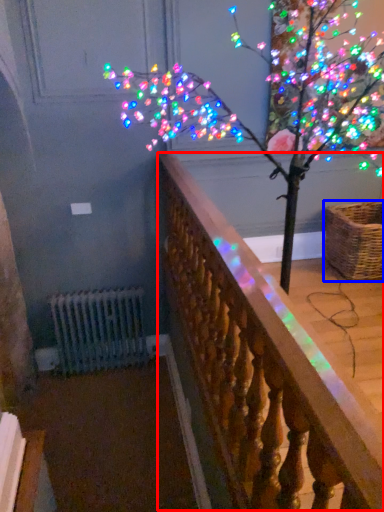
Question: Among these objects, which one is farthest to the camera, rail (highlighted by a red box) or basket (highlighted by a blue box)?

Choices:
 (A) rail
 (B) basket

Answer: (B)